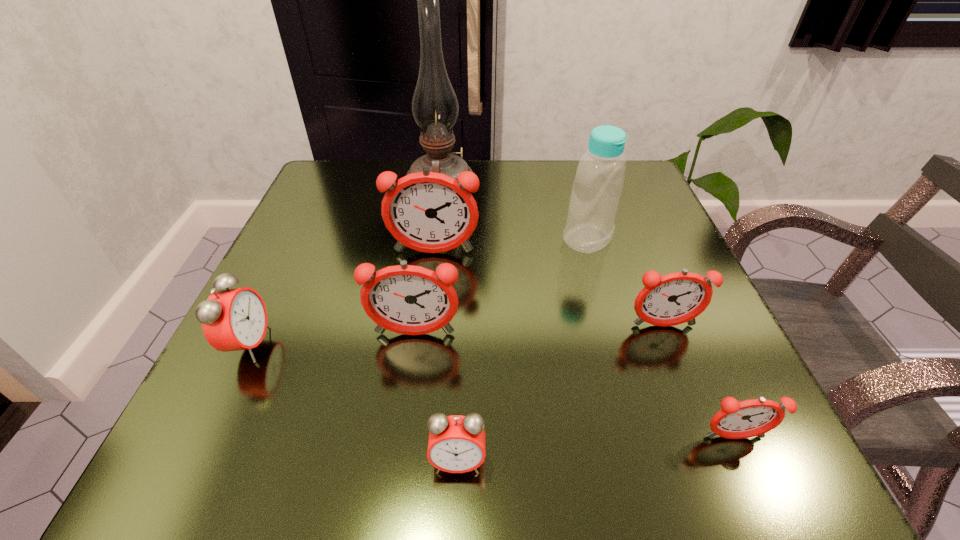
Find the location of a particular element. The image size is (960, 540). the leftmost object is located at coordinates (233, 319).

This screenshot has width=960, height=540. I want to click on the smallest reddish-pink alarm clock, so click(736, 420).

You are a GUI agent. You are given a task and a screenshot of the screen. Output one action in this format:
    pyautogui.click(x=<x>, y=<y>)
    Task: Click on the smaller red alarm clock
    Image resolution: width=960 pixels, height=540 pixels.
    Given the screenshot: What is the action you would take?
    pyautogui.click(x=456, y=444)

Image resolution: width=960 pixels, height=540 pixels. I want to click on the nearer red alarm clock, so click(x=456, y=444).

Where is `vacant region located 0.110m on the left of the bronze oil lamp`? Image resolution: width=960 pixels, height=540 pixels. vacant region located 0.110m on the left of the bronze oil lamp is located at coordinates (359, 182).

Locate an element on the screen. The height and width of the screenshot is (540, 960). vacant space located on the left of the bottle is located at coordinates (480, 239).

Identify the location of free location located on the front-facing side of the third tallest object. (431, 278).

Where is `vacant position located on the front-facing side of the second biggest reddish-pink alarm clock`? Image resolution: width=960 pixels, height=540 pixels. vacant position located on the front-facing side of the second biggest reddish-pink alarm clock is located at coordinates (396, 463).

You are a GUI agent. You are given a task and a screenshot of the screen. Output one action in this format:
    pyautogui.click(x=<x>, y=<y>)
    Task: Click on the free space located 0.100m on the front-facing side of the second smallest reddish-pink alarm clock
    
    Given the screenshot: What is the action you would take?
    pyautogui.click(x=687, y=387)

You are a GUI agent. You are given a task and a screenshot of the screen. Output one action in this format:
    pyautogui.click(x=<x>, y=<y>)
    Task: Click on the free location located on the front-facing side of the leftmost object
    
    Given the screenshot: What is the action you would take?
    pyautogui.click(x=365, y=345)